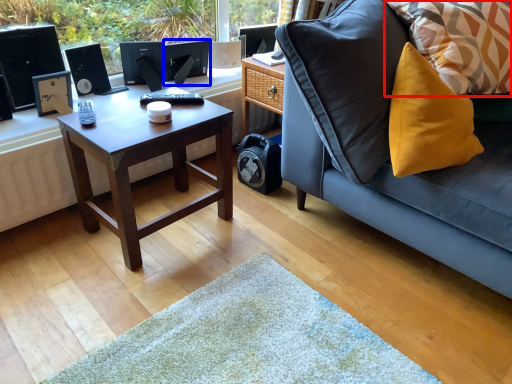
Question: Which point is further to the camera, pillow (highlighted by a red box) or computer monitor (highlighted by a blue box)?

Choices:
 (A) pillow
 (B) computer monitor

Answer: (B)